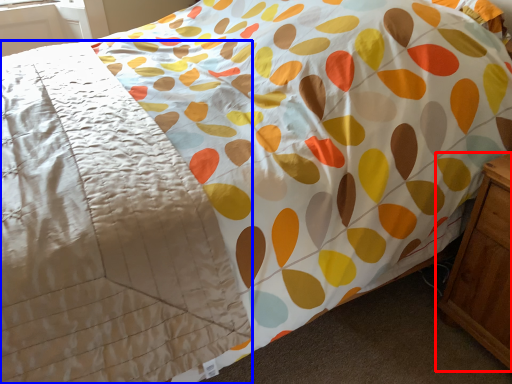
Question: Which object appears farthest to the camera in this image, nightstand (highlighted by a red box) or blanket (highlighted by a blue box)?

Choices:
 (A) nightstand
 (B) blanket

Answer: (A)